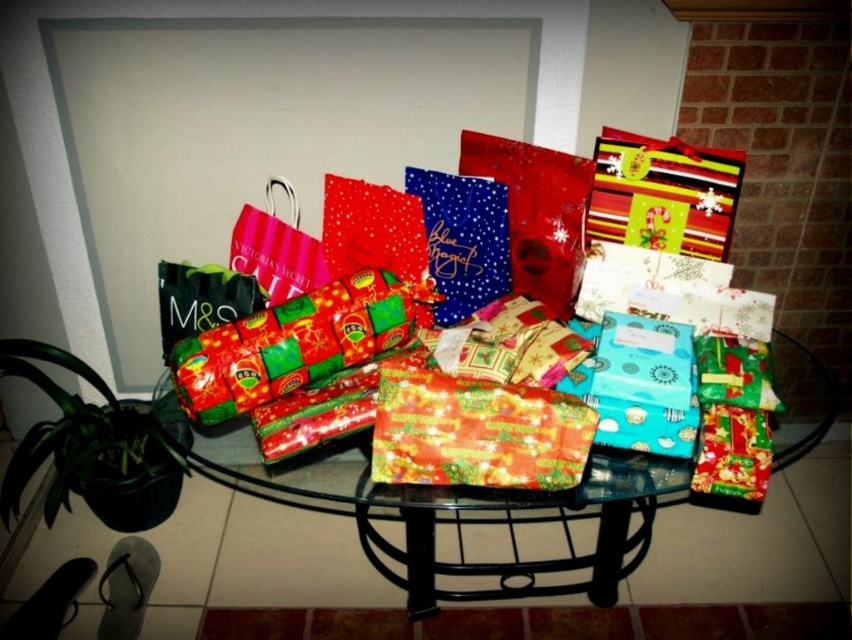
Which is below, translucent glass table at center or shiny red wrapping paper at center?

Positioned lower is translucent glass table at center.

Who is positioned more to the left, translucent glass table at center or shiny red wrapping paper at center?

shiny red wrapping paper at center

Does point (459, 541) lie behind point (435, 428)?

Yes, it is behind point (435, 428).

Where is `translucent glass table at center`? The height and width of the screenshot is (640, 852). translucent glass table at center is located at coordinates (496, 520).